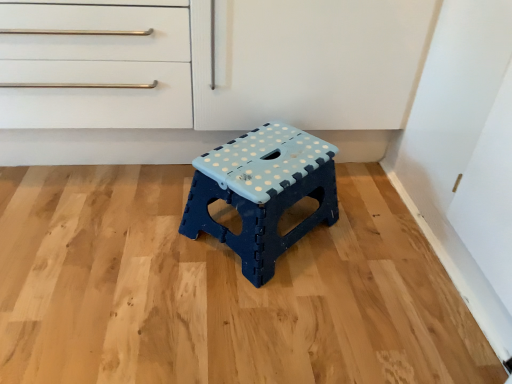
At what (x,y) coordinates should I click in order to perform the action: click on vacant area that is situated to the right of blue plastic stool at center. Please return your answer as a coordinate pair (x, y). This screenshot has width=512, height=384. Looking at the image, I should click on (372, 246).